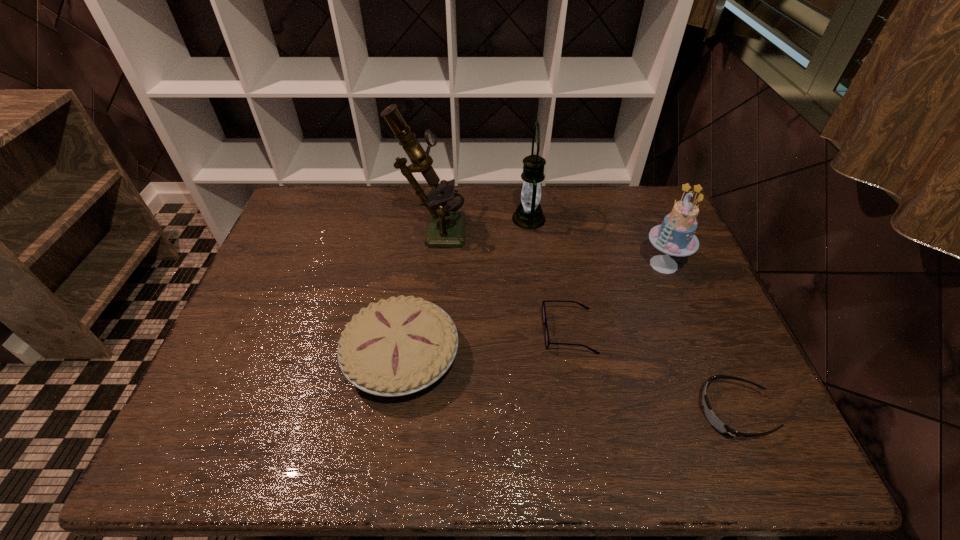
Find the location of `vacant space at the near left corner of the desktop`. vacant space at the near left corner of the desktop is located at coordinates (218, 453).

Where is `vacant area at the far right corner of the desktop`? vacant area at the far right corner of the desktop is located at coordinates (646, 207).

Locate an element on the screen. free space between the sunglasses and the spectacles is located at coordinates [652, 372].

At what (x,y) coordinates should I click in order to perform the action: click on free space between the lantern and the cake. Please return your answer as a coordinate pair (x, y). The image size is (960, 540). Looking at the image, I should click on (596, 241).

This screenshot has width=960, height=540. I want to click on empty space that is in between the spectacles and the cake, so click(x=616, y=298).

Identify the location of free spot between the tallest object and the cake. This screenshot has height=540, width=960. (548, 246).

I want to click on free spot between the third tallest object and the pie, so click(x=533, y=310).

Identify the location of free spot between the tallest object and the sunglasses. The image size is (960, 540). (584, 320).

Locate an element on the screen. The width and height of the screenshot is (960, 540). free space between the pie and the sunglasses is located at coordinates click(x=567, y=384).

What are the coordinates of `free spot between the microscope and the sunglasses` in the screenshot? It's located at (584, 320).